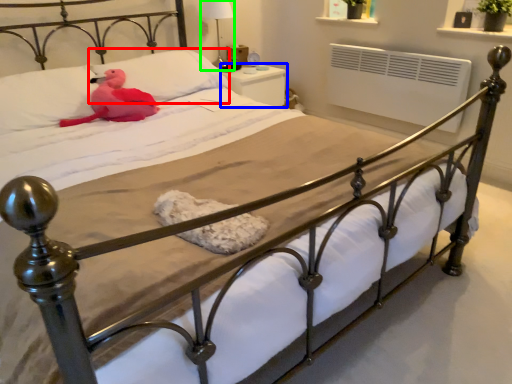
Question: Estimate the real-world distances between objects in this image. Which object is farther from pillow (highlighted by a red box), nightstand (highlighted by a blue box) or table lamp (highlighted by a green box)?

Choices:
 (A) nightstand
 (B) table lamp

Answer: (B)